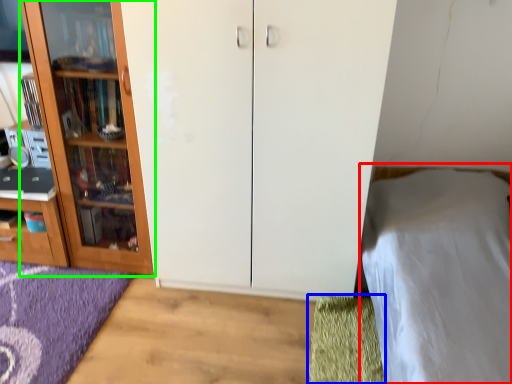
Question: Which is nearer to the bed (highlighted by a red box)? doormat (highlighted by a blue box) or cupboard (highlighted by a green box).

Choices:
 (A) doormat
 (B) cupboard

Answer: (A)